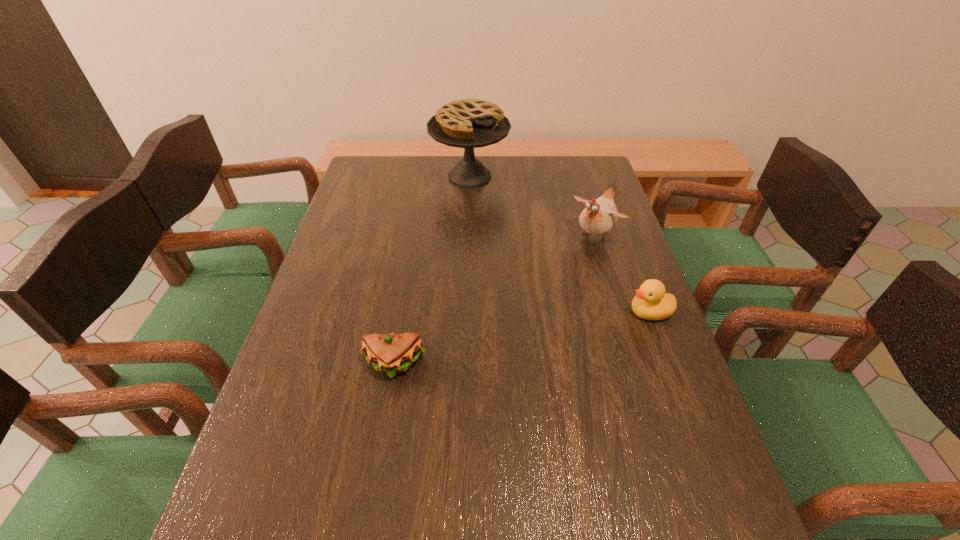
At what (x,y) coordinates should I click in order to perform the action: click on sandwich. Please return your answer as a coordinate pair (x, y). The width and height of the screenshot is (960, 540). Looking at the image, I should click on pos(392,353).

At what (x,y) coordinates should I click in order to perform the action: click on duckling. Please return your answer as a coordinate pair (x, y). Looking at the image, I should click on (650, 302).

Identify the location of bird. This screenshot has height=540, width=960. (600, 216).

Locate an element on the screen. the second farthest object is located at coordinates (600, 216).

Find the location of a particular element. the farthest object is located at coordinates (468, 123).

Identify the location of pie. This screenshot has width=960, height=540. coord(468,123).

Where is `vacant space located on the right of the sandwich`? vacant space located on the right of the sandwich is located at coordinates (483, 365).

At what (x,y) coordinates should I click in order to perform the action: click on free space located on the face of the second nearest object. Please return your answer as a coordinate pair (x, y). Looking at the image, I should click on (600, 312).

At what (x,y) coordinates should I click in order to perform the action: click on vacant region located 0.090m on the face of the second nearest object. Please return your answer as a coordinate pair (x, y). Looking at the image, I should click on (592, 312).

The image size is (960, 540). Find the location of `vacant space located 0.320m on the face of the second nearest object`. vacant space located 0.320m on the face of the second nearest object is located at coordinates (501, 312).